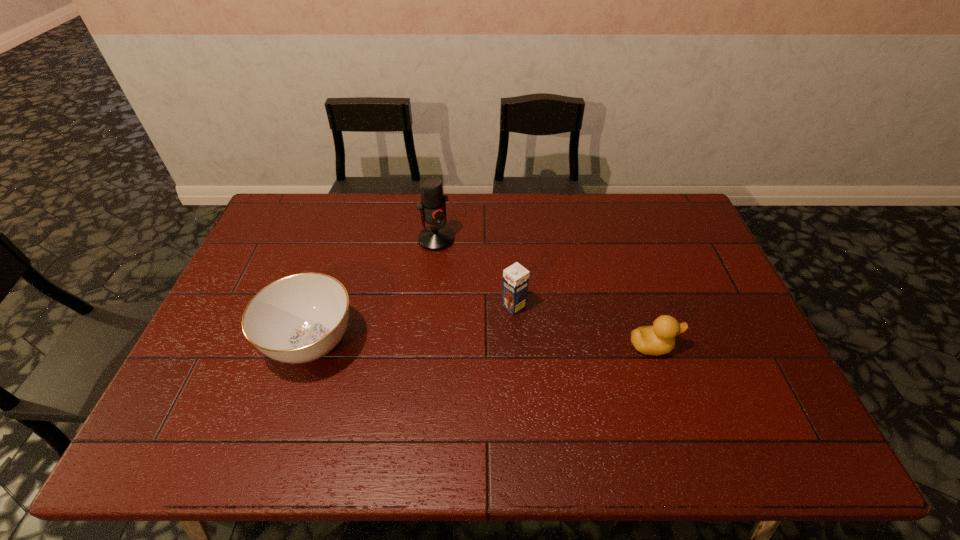
This screenshot has width=960, height=540. What are the coordinates of `vacant spot on the desktop that is between the chinaware and the rightmost object and is positioned on the side of the farthest object with the red ring` in the screenshot? It's located at (514, 345).

Locate an element on the screen. The image size is (960, 540). vacant spot on the desktop that is between the chinaware and the rightmost object and is positioned on the front label of the third object from left to right is located at coordinates (457, 344).